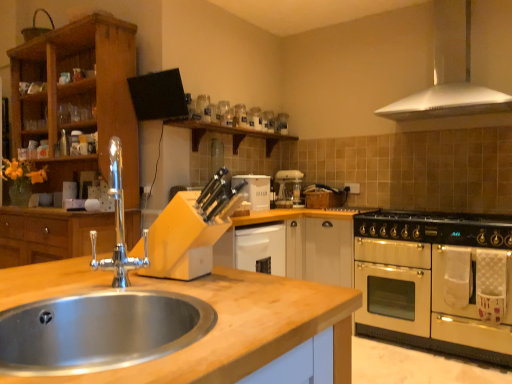
Question: Considering the positions of point (132, 322) and point (261, 180), is point (132, 322) closer or farther from the camera than point (261, 180)?

Choices:
 (A) farther
 (B) closer

Answer: (B)

Question: Is stainless steel sink at lower left taller or shorter than white matte bread bin at center?

Choices:
 (A) tall
 (B) short

Answer: (B)

Question: Based on their relative distances, which object is farther from the white metallic exhaust hood at upper right?

Choices:
 (A) black matte gas stove at right
 (B) cream matte oven at right
 (C) polished chrome faucet at sink left
 (D) white plastic coffee machine at center
 (E) white matte bread bin at center

Answer: (C)

Question: Considering the real-world distances, which object is closest to the white metallic exhaust hood at upper right?

Choices:
 (A) polished chrome faucet at sink left
 (B) cream matte oven at right
 (C) stainless steel sink at lower left
 (D) white matte bread bin at center
 (E) white plastic coffee machine at center

Answer: (B)